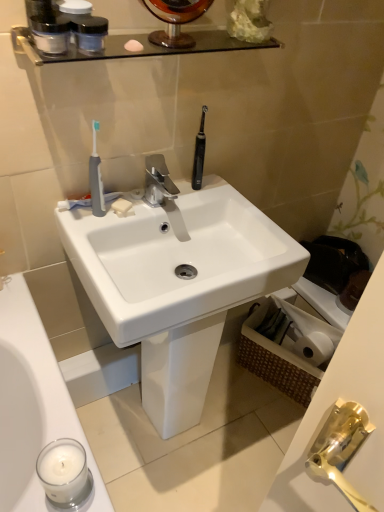
This screenshot has height=512, width=384. What do you see at coordinates (135, 52) in the screenshot?
I see `transparent glass shelf at upper center` at bounding box center [135, 52].

The height and width of the screenshot is (512, 384). I want to click on transparent glass shelf at upper center, so click(135, 52).

What do you see at coordinates (74, 7) in the screenshot? I see `matte black jars at upper left` at bounding box center [74, 7].

Identify the location of translucent plastic containers at upper left, which appears as the 2th mouthwash when viewed from the right. (50, 34).

What do you see at coordinates (175, 20) in the screenshot?
I see `wooden polished mirror at upper center` at bounding box center [175, 20].

What do you see at coordinates (310, 334) in the screenshot?
I see `white matte toilet paper at lower right` at bounding box center [310, 334].

In order to face gray rubber toothbrush at left, should I rotate leftwards or rightwards?

Turn left approximately 12.595 degrees to face it.

The width and height of the screenshot is (384, 512). In order to click on white matte soap at center in this screenshot , I will do `click(122, 207)`.

Measure the distance between polished chrome faucet at center and camera.

polished chrome faucet at center is 1.13 meters away from camera.

This screenshot has width=384, height=512. In order to click on transparent glass shelf at upper center in this screenshot , I will do `click(135, 52)`.

Based on the photo, who is smaller, wooden polished mirror at upper center or polished chrome faucet at center?

With smaller size is polished chrome faucet at center.

Is wooden polished mirror at upper center completely or partially outside of polished chrome faucet at center?

Yes, wooden polished mirror at upper center is outside of polished chrome faucet at center.

Does wooden polished mirror at upper center have a greater height compared to polished chrome faucet at center?

Yes.

From the image's perspective, which is below, wooden polished mirror at upper center or polished chrome faucet at center?

polished chrome faucet at center.

Does point (34, 49) lie in front of point (78, 4)?

Yes.

From the image's perspective, does transparent glass shelf at upper center appear lower than matte black jars at upper left?

Yes, from the image's perspective, transparent glass shelf at upper center is below matte black jars at upper left.

Choose the correct answer: Is transparent glass shelf at upper center inside matte black jars at upper left or outside it?

transparent glass shelf at upper center is not enclosed by matte black jars at upper left.

From the image's perspective, is wooden polished mirror at upper center above or below white glossy sink at center?

wooden polished mirror at upper center is situated higher than white glossy sink at center in the image.

Does point (170, 23) appear closer or farther from the camera than point (185, 408)?

Point (170, 23).

Where is `mirror on the right of the white glossy sink at center`? The height and width of the screenshot is (512, 384). mirror on the right of the white glossy sink at center is located at coordinates (175, 20).

Relative to gray rubber toothbrush at left, is white glossy sink at center in front or behind?

white glossy sink at center is in front of gray rubber toothbrush at left.

This screenshot has height=512, width=384. Identify the location of toothbrush behind the white glossy sink at center. (96, 178).

Who is smaller, white glossy sink at center or gray rubber toothbrush at left?

gray rubber toothbrush at left.

Considering the positions of objects white glossy sink at center and gray rubber toothbrush at left in the image provided, who is more to the right, white glossy sink at center or gray rubber toothbrush at left?

From the viewer's perspective, white glossy sink at center appears more on the right side.

Between point (128, 214) and point (154, 173), which one is positioned in front?

Positioned in front is point (128, 214).

Can you confirm if white matte soap at center is taller than polished chrome faucet at center?

Incorrect, the height of white matte soap at center is not larger of that of polished chrome faucet at center.

Locate an element on the screen. The width and height of the screenshot is (384, 512). tap on the right side of white matte soap at center is located at coordinates (158, 181).

The image size is (384, 512). I want to click on soap in front of the white matte toilet paper at lower right, so pyautogui.click(x=122, y=207).

Looking at this image, from the image's perspective, would you say white matte soap at center is shown under white matte toilet paper at lower right?

Incorrect, from the image's perspective, white matte soap at center is higher than white matte toilet paper at lower right.

Is white matte soap at center wider than white matte toilet paper at lower right?

Incorrect, the width of white matte soap at center does not surpass that of white matte toilet paper at lower right.

Based on their positions, is white matte soap at center located to the left or right of white matte toilet paper at lower right?

white matte soap at center is to the left of white matte toilet paper at lower right.

Based on the photo, which is correct: white glossy sink at center is inside transparent glass shelf at upper center, or outside of it?

white glossy sink at center is outside transparent glass shelf at upper center.

Is white glossy sink at center looking in the opposite direction of transparent glass shelf at upper center?

white glossy sink at center is not turned away from transparent glass shelf at upper center.

Is point (130, 319) in front of point (153, 52)?

Yes, point (130, 319) is closer to viewer.

From a real-world perspective, between white glossy sink at center and transparent glass shelf at upper center, who is vertically higher?

In real-world perspective, transparent glass shelf at upper center is above.

Image resolution: width=384 pixels, height=512 pixels. I want to click on mirror on the right of polished chrome faucet at center, so click(x=175, y=20).

The image size is (384, 512). Find the location of `toiletry that appears above the transparent glass shelf at upper center (from a real-world perspective)`. toiletry that appears above the transparent glass shelf at upper center (from a real-world perspective) is located at coordinates (74, 7).

Considering their positions, is white matte toilet paper at lower right positioned further to wooden polished mirror at upper center than polished chrome faucet at center?

Based on the image, white matte toilet paper at lower right appears to be further to wooden polished mirror at upper center.

When comparing their distances from white matte soap at center, does transparent glass shelf at upper center or transparent plastic mouthwash at upper center, marked as the first mouthwash in a right-to-left arrangement, seem further?

transparent plastic mouthwash at upper center, marked as the first mouthwash in a right-to-left arrangement.

When comparing their distances from transparent glass shelf at upper center, does white matte soap at center or wooden polished mirror at upper center seem closer?

wooden polished mirror at upper center is positioned closer to the anchor transparent glass shelf at upper center.

Which object lies nearer to the anchor point white matte toilet paper at lower right, transparent plastic mouthwash at upper center, marked as the first mouthwash in a right-to-left arrangement, or translucent plastic containers at upper left, which is counted as the first mouthwash, starting from the left?

Based on the image, transparent plastic mouthwash at upper center, marked as the first mouthwash in a right-to-left arrangement, appears to be nearer to white matte toilet paper at lower right.

From the image, which object appears to be nearer to gray rubber toothbrush at left, white matte toilet paper at lower right or translucent plastic containers at upper left, which is counted as the first mouthwash, starting from the left?

translucent plastic containers at upper left, which is counted as the first mouthwash, starting from the left, lies closer to gray rubber toothbrush at left than the other object.

When comparing their distances from transparent plastic mouthwash at upper center, marked as the first mouthwash in a right-to-left arrangement, does polished chrome faucet at center or white glossy sink at center seem closer?

polished chrome faucet at center is positioned closer to the anchor transparent plastic mouthwash at upper center, marked as the first mouthwash in a right-to-left arrangement.

Considering their positions, is transparent plastic mouthwash at upper center, marked as the first mouthwash in a right-to-left arrangement, positioned further to transparent glass shelf at upper center than white glossy sink at center?

Among the two, white glossy sink at center is located further to transparent glass shelf at upper center.

When comparing their distances from white matte toilet paper at lower right, does white glossy sink at center or transparent glass shelf at upper center seem closer?

The object closer to white matte toilet paper at lower right is white glossy sink at center.

At what (x,y) coordinates should I click in order to perform the action: click on mouthwash located between translucent plastic containers at upper left, which appears as the 2th mouthwash when viewed from the right, and white matte soap at center in the depth direction. Please return your answer as a coordinate pair (x, y). This screenshot has width=384, height=512. Looking at the image, I should click on (89, 32).

Identify the location of balustrade between matte black jars at upper left and gray rubber toothbrush at left in the vertical direction. (135, 52).

At what (x,y) coordinates should I click in order to perform the action: click on toiletry between wooden polished mirror at upper center and white matte toilet paper at lower right from top to bottom. Please return your answer as a coordinate pair (x, y). Looking at the image, I should click on (74, 7).

Where is `toothbrush between matte black jars at upper left and white matte soap at center in the up-down direction`? toothbrush between matte black jars at upper left and white matte soap at center in the up-down direction is located at coordinates (96, 178).